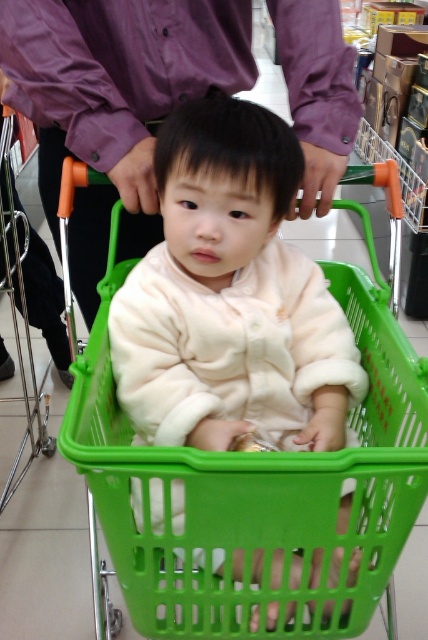
Question: Can you confirm if soft beige baby at center is wider than purple cotton shirt at upper center?

Choices:
 (A) yes
 (B) no

Answer: (B)

Question: Is soft beige baby at center to the left of purple cotton shirt at upper center from the viewer's perspective?

Choices:
 (A) no
 (B) yes

Answer: (A)

Question: Can you confirm if soft beige baby at center is wider than purple cotton shirt at upper center?

Choices:
 (A) yes
 (B) no

Answer: (B)

Question: Which point is farther from the camera taking this photo?

Choices:
 (A) (216, 141)
 (B) (249, 26)

Answer: (B)